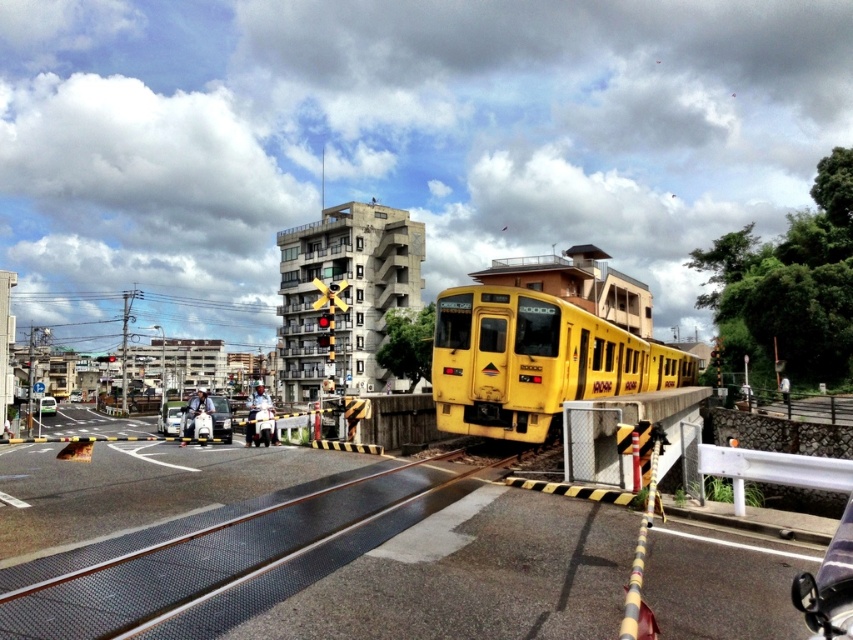
Question: Which point is closer to the camera taking this photo?

Choices:
 (A) (177, 433)
 (B) (184, 429)

Answer: (B)

Question: Considering the real-world distances, which object is farthest from the yellow matte train at center?

Choices:
 (A) black rubber train track at lower center
 (B) green matte car at lower left
 (C) metallic silver car at lower left

Answer: (B)

Question: Which point is farther from the camera taking this photo?

Choices:
 (A) (216, 400)
 (B) (157, 428)

Answer: (B)

Question: Can you confirm if white matte car at center is smaller than metallic silver car at lower left?

Choices:
 (A) yes
 (B) no

Answer: (B)

Question: Can you confirm if white matte car at center is positioned below green matte car at lower left?

Choices:
 (A) no
 (B) yes

Answer: (A)

Question: Does black rubber train track at lower center appear on the right side of metallic silver car at lower left?

Choices:
 (A) yes
 (B) no

Answer: (A)